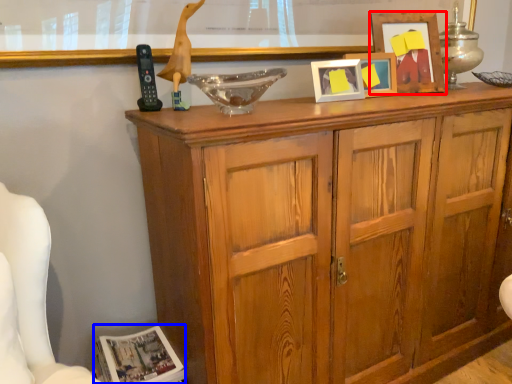
Question: Among these objects, which one is farthest to the camera, picture frame (highlighted by a red box) or magazine (highlighted by a blue box)?

Choices:
 (A) picture frame
 (B) magazine

Answer: (A)